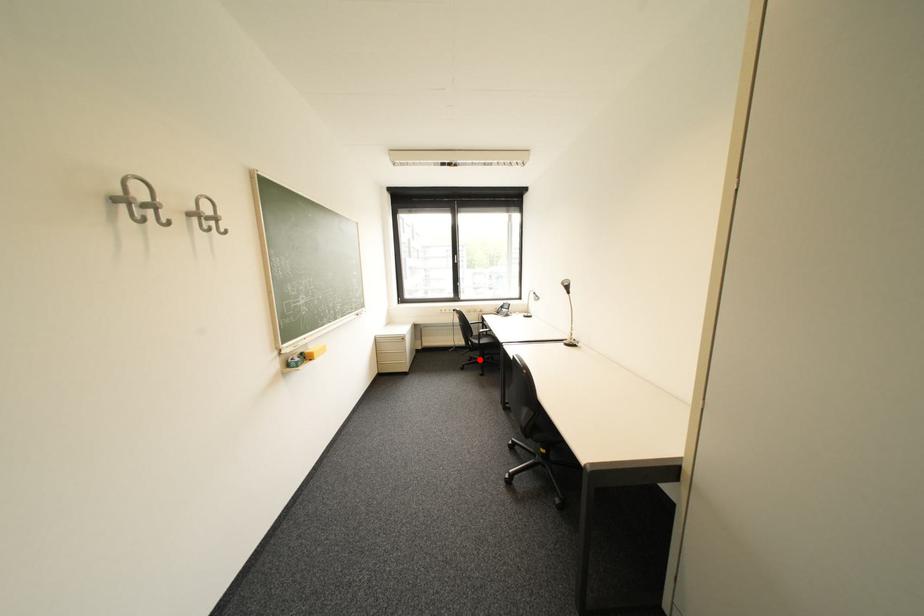
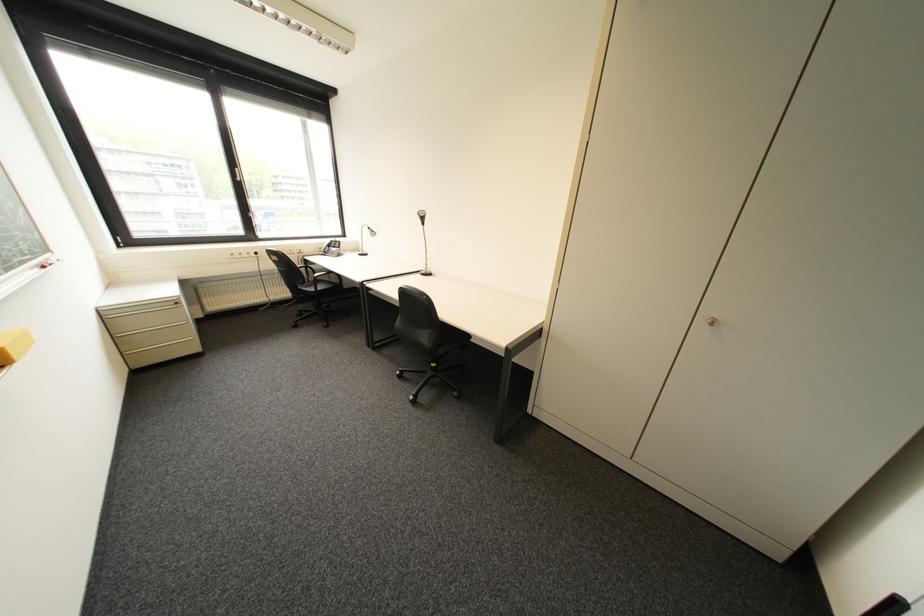
Question: I am providing you with two images of the same scene from different viewpoints. Given a red point in image1, look at the same physical point in image2. Is it:

Choices:
 (A) Closer to the viewpoint
 (B) Farther from the viewpoint

Answer: (A)